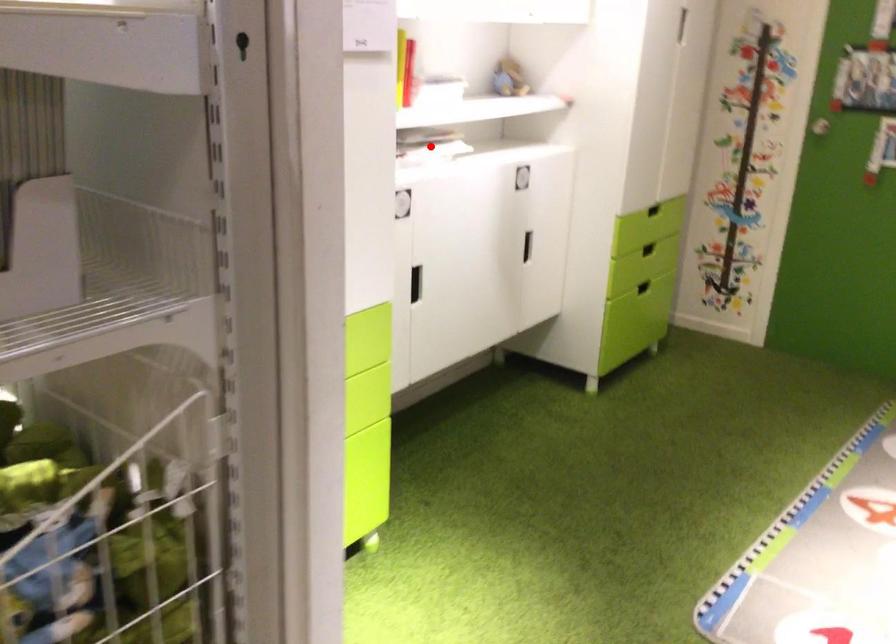
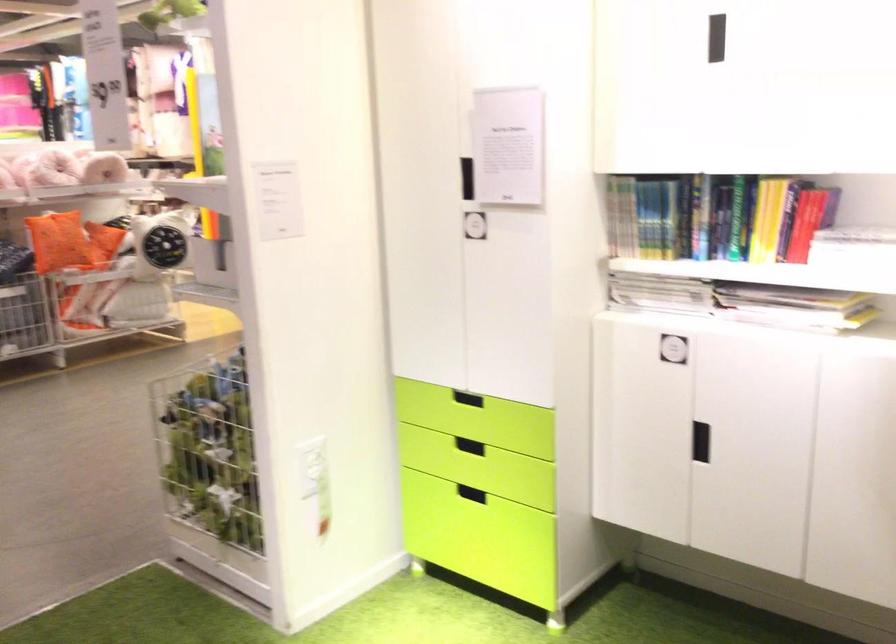
Question: A red point is marked in image1. In image2, is the corresponding 3D point closer to the camera or farther? Reply with the corresponding letter.

Choices:
 (A) The corresponding 3D point is closer.
 (B) The corresponding 3D point is farther.

Answer: (A)